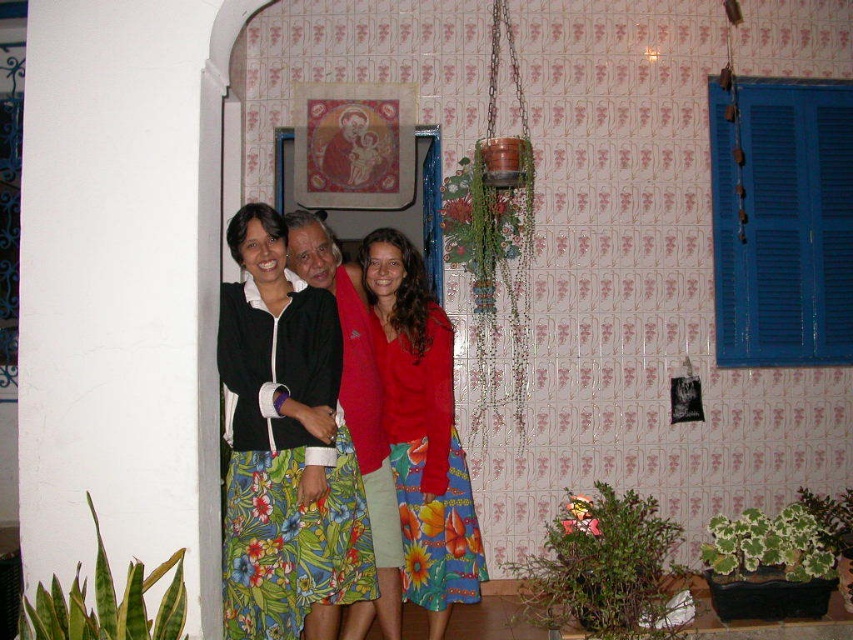
You are standing in the same room as the people in the image. The doorway is 2 meters away from you. If you want to walk to the doorway, will you pass by the floral fabric skirt at center?

The floral fabric skirt at center is 3.00 meters away from you, which is farther than the doorway that is only 2 meters away. Therefore, you would not pass by the floral fabric skirt at center on your way to the doorway.

You are a fashion designer observing the scene. You notice the floral fabric skirt at center and the matte black jacket at center. Which clothing item is layered on top?

The floral fabric skirt at center is positioned over matte black jacket at center, so the floral fabric skirt at center is layered on top.